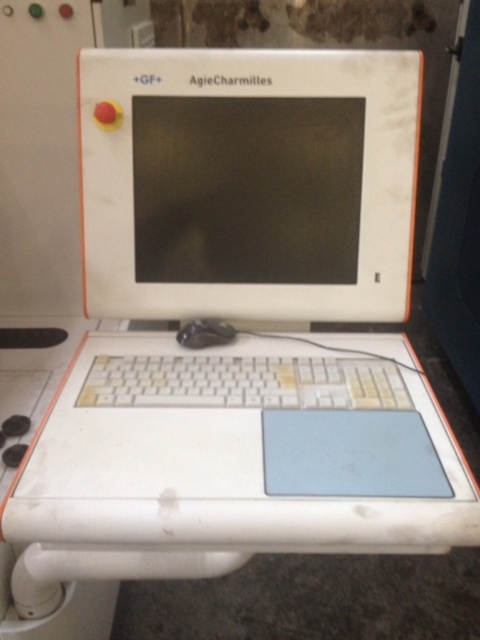
Question: Is white plastic monitor at center positioned in front of white matte computer at center?

Choices:
 (A) no
 (B) yes

Answer: (B)

Question: Is the position of white matte computer at center less distant than that of white plastic keyboard at center?

Choices:
 (A) no
 (B) yes

Answer: (A)

Question: Which object is positioned farthest from the white matte computer at center?

Choices:
 (A) white plastic keyboard at center
 (B) black rubber mouse at center
 (C) white plastic monitor at center
 (D) white plastic table at center

Answer: (D)

Question: Does white plastic monitor at center appear on the left side of white plastic table at center?

Choices:
 (A) yes
 (B) no

Answer: (B)

Question: Which of the following is the closest to the observer?

Choices:
 (A) white matte computer at center
 (B) white plastic keyboard at center
 (C) white plastic table at center

Answer: (C)

Question: Which point appears farthest from the camera in this image?

Choices:
 (A) (129, 253)
 (B) (228, 332)

Answer: (B)